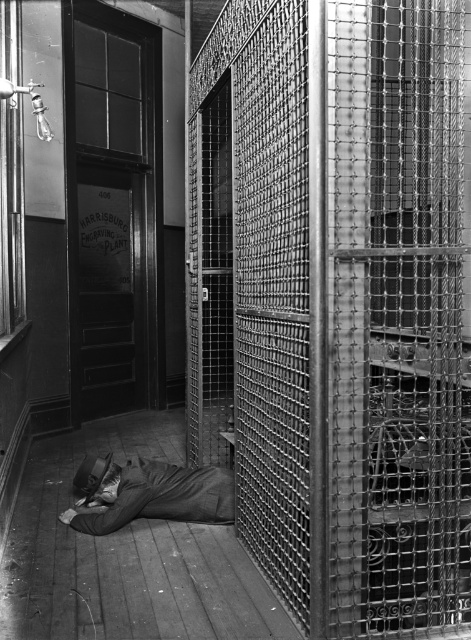
Question: In this image, where is metal mesh cage at center located relative to dark gray fabric at lower center?

Choices:
 (A) right
 (B) left

Answer: (A)

Question: Which point appears farthest from the camera in this image?

Choices:
 (A) (170, 499)
 (B) (333, 566)

Answer: (A)

Question: In this image, where is metal mesh cage at center located relative to dark gray fabric at lower center?

Choices:
 (A) below
 (B) above

Answer: (B)

Question: Is metal mesh cage at center thinner than dark gray fabric at lower center?

Choices:
 (A) yes
 (B) no

Answer: (B)

Question: Which point is farther from the camera taking this photo?

Choices:
 (A) (237, 204)
 (B) (154, 496)

Answer: (B)

Question: Which of the following is the closest to the observer?

Choices:
 (A) (378, 493)
 (B) (146, 512)

Answer: (B)